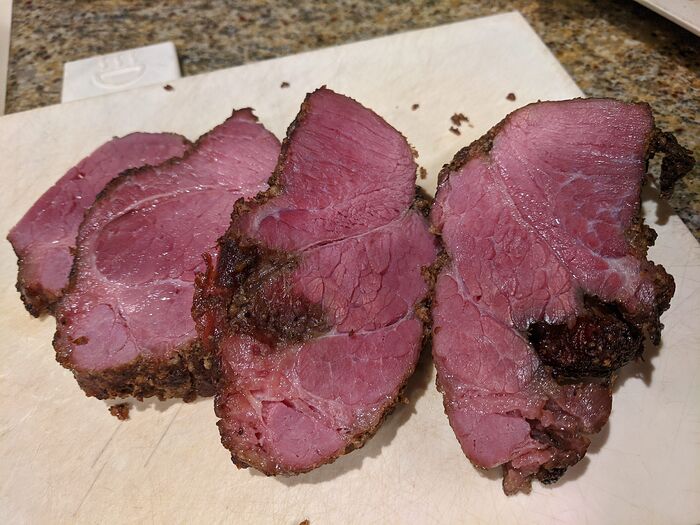
In order to click on countertop in this screenshot , I will do `click(612, 83)`.